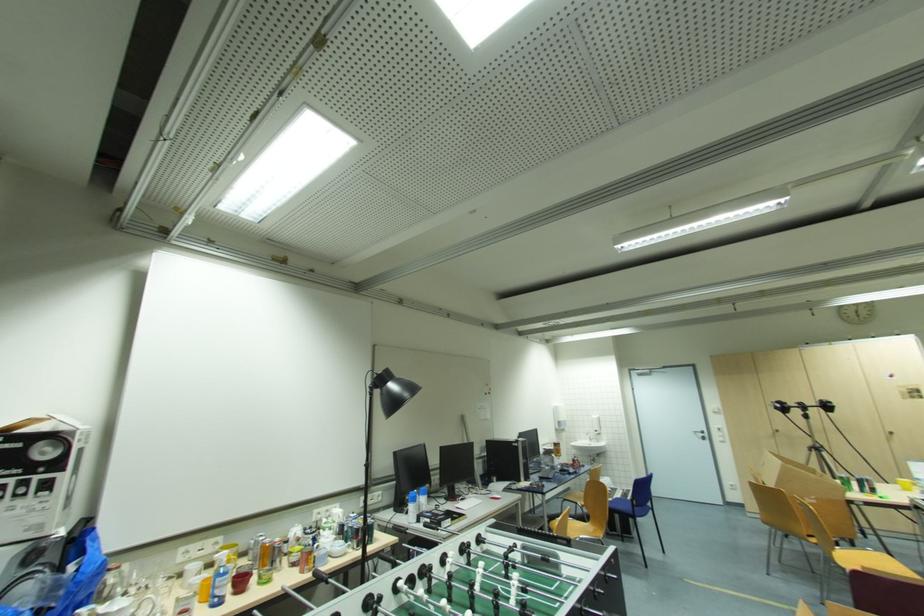
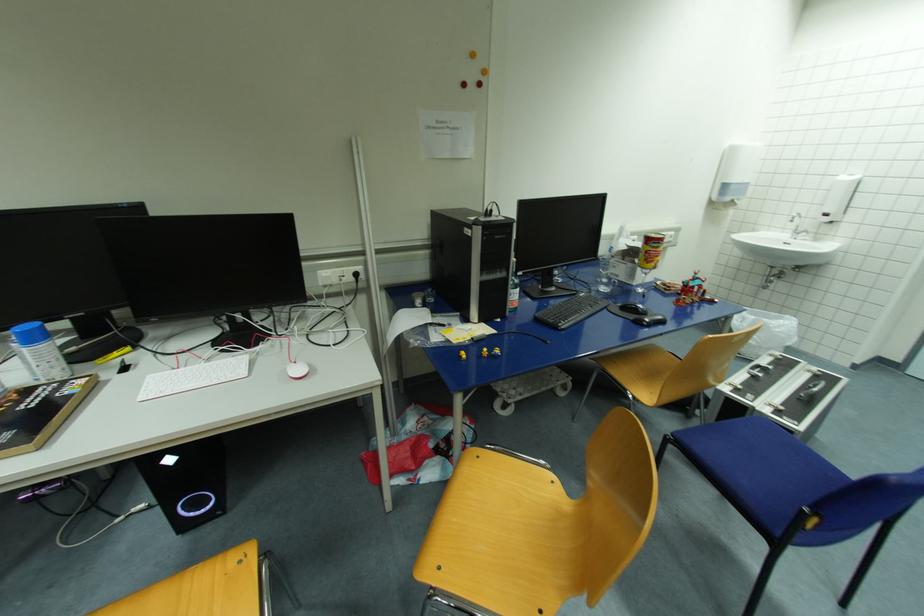
Find the pixel in the second image that matches point (560, 445) in the first image.

(653, 241)